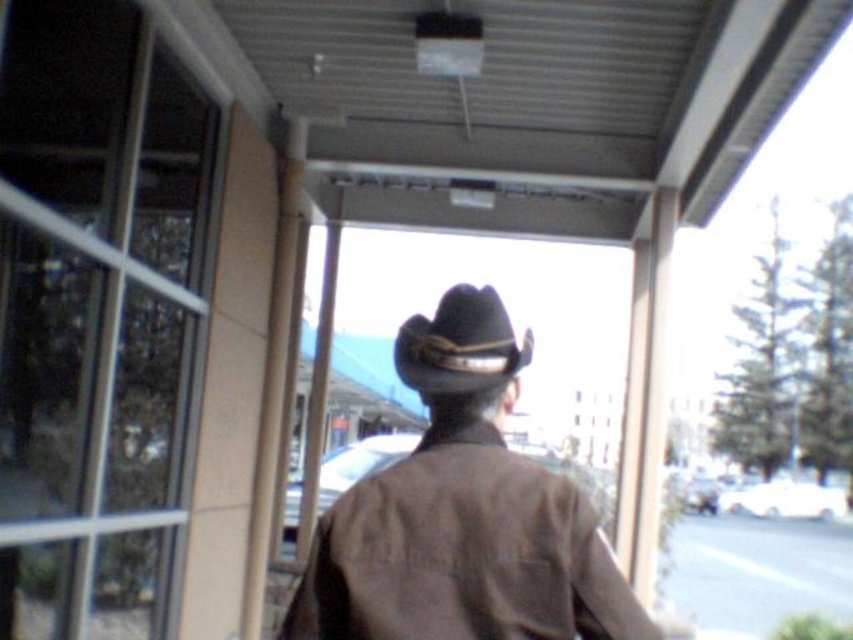
Question: Which is nearer to the gray asphalt pavement at lower right?

Choices:
 (A) brown leather cowboy hat at center
 (B) black felt cowboy hat at center

Answer: (B)

Question: Does gray asphalt pavement at lower right appear on the right side of black felt cowboy hat at center?

Choices:
 (A) no
 (B) yes

Answer: (B)

Question: Which point is closer to the camera?

Choices:
 (A) (724, 595)
 (B) (416, 481)

Answer: (B)

Question: Which of the following is the closest to the observer?

Choices:
 (A) (492, 492)
 (B) (422, 337)

Answer: (A)

Question: Does gray asphalt pavement at lower right come in front of black felt cowboy hat at center?

Choices:
 (A) no
 (B) yes

Answer: (A)

Question: In this image, where is brown leather cowboy hat at center located relative to black felt cowboy hat at center?

Choices:
 (A) below
 (B) above

Answer: (A)